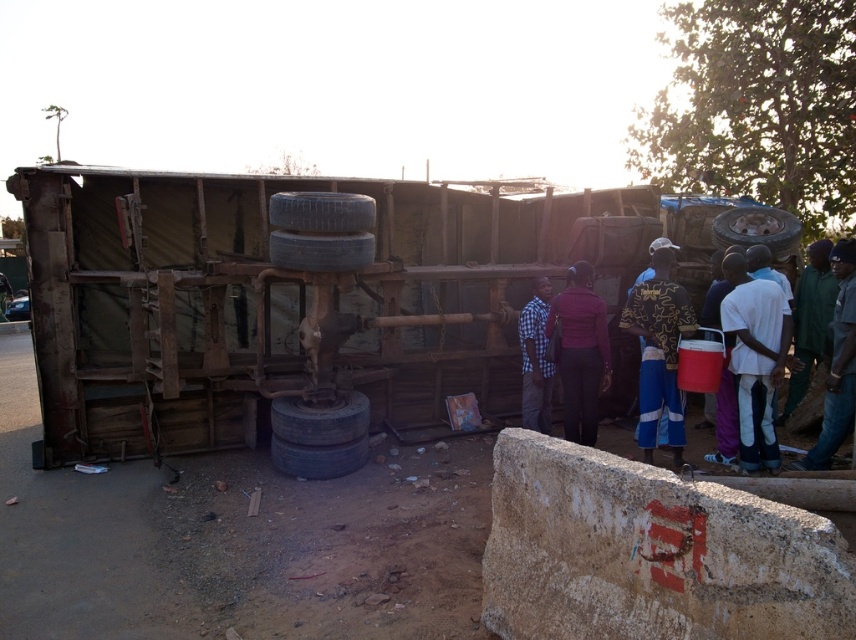
Is purple matte shirt at center bigger than green fabric jacket at right?

Actually, purple matte shirt at center might be smaller than green fabric jacket at right.

Who is higher up, purple matte shirt at center or green fabric jacket at right?

green fabric jacket at right is above.

Does point (572, 333) lie behind point (834, 330)?

Yes, point (572, 333) is farther from viewer.

Locate an element on the screen. This screenshot has width=856, height=640. purple matte shirt at center is located at coordinates (580, 353).

This screenshot has height=640, width=856. Identify the location of green fabric jacket at right. (837, 364).

This screenshot has width=856, height=640. In order to click on green fabric jacket at right in this screenshot , I will do `click(837, 364)`.

Is rubber/rough tire at center closer to camera compared to blue rubber tire at center?

No, rubber/rough tire at center is behind blue rubber tire at center.

Is rubber/rough tire at center to the left of blue rubber tire at center from the viewer's perspective?

Yes, rubber/rough tire at center is to the left of blue rubber tire at center.

Is point (349, 396) less distant than point (367, 195)?

Yes, it is in front of point (367, 195).

Find the location of a particular element. This screenshot has width=856, height=640. rubber/rough tire at center is located at coordinates (321, 420).